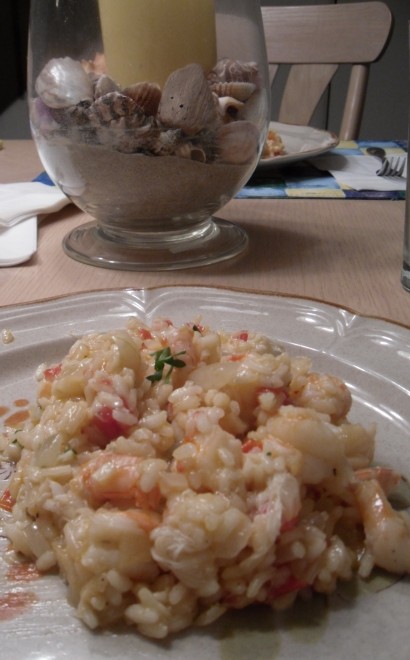
At what (x,y) coordinates should I click in order to perform the action: click on chair. Please return your answer as a coordinate pair (x, y). The width and height of the screenshot is (410, 660). Looking at the image, I should click on (330, 37).